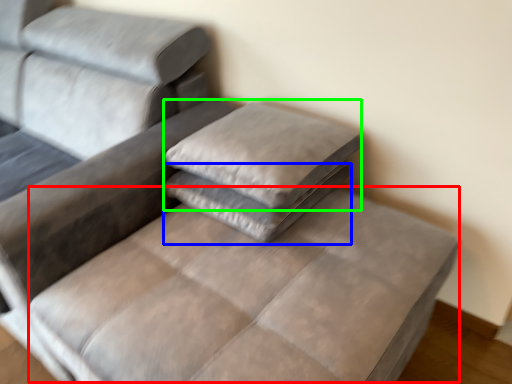
Question: Which object is positioned closest to mattress (highlighted by a red box)? Select from pillow (highlighted by a blue box) and pillow (highlighted by a green box).

Choices:
 (A) pillow
 (B) pillow

Answer: (A)